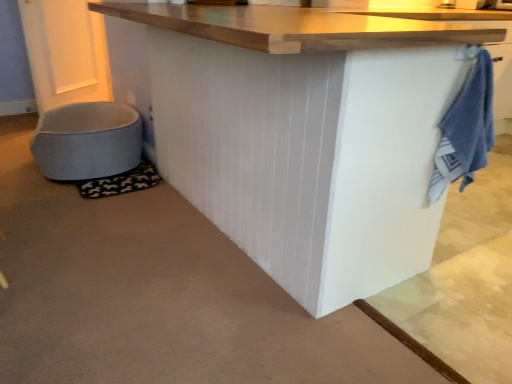
Question: Relative to blue terry cloth towel at right, is white matte table at center in front or behind?

Choices:
 (A) behind
 (B) front

Answer: (B)

Question: From the image's perspective, is white matte table at center located above or below blue terry cloth towel at right?

Choices:
 (A) above
 (B) below

Answer: (A)

Question: Which object is positioned closest to the white matte table at center?

Choices:
 (A) light blue fabric pet bed at lower left
 (B) blue terry cloth towel at right

Answer: (B)

Question: Which is farther from the blue terry cloth towel at right?

Choices:
 (A) light blue fabric pet bed at lower left
 (B) white matte table at center

Answer: (A)